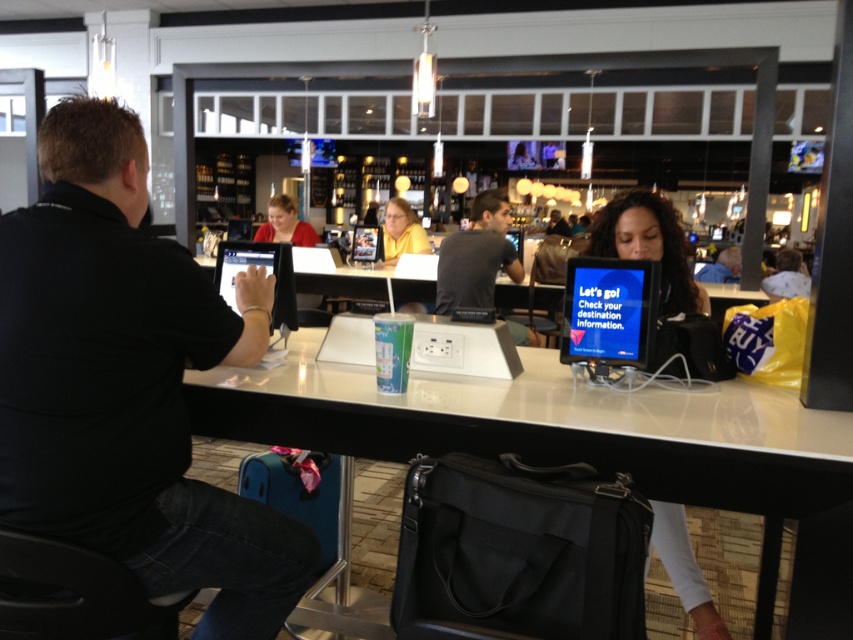
You are a person standing in the lounge area and you see both the yellow matte shirt at center and the matte red shirt at center. Which shirt is closer to you?

The yellow matte shirt at center is closer to you because it is in front of the matte red shirt at center.